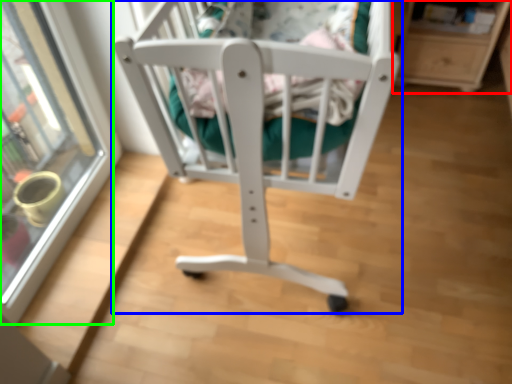
Question: Which object is positioned farthest from shelf (highlighted by a red box)? Select from furniture (highlighted by a blue box) and glass door (highlighted by a green box).

Choices:
 (A) furniture
 (B) glass door

Answer: (B)